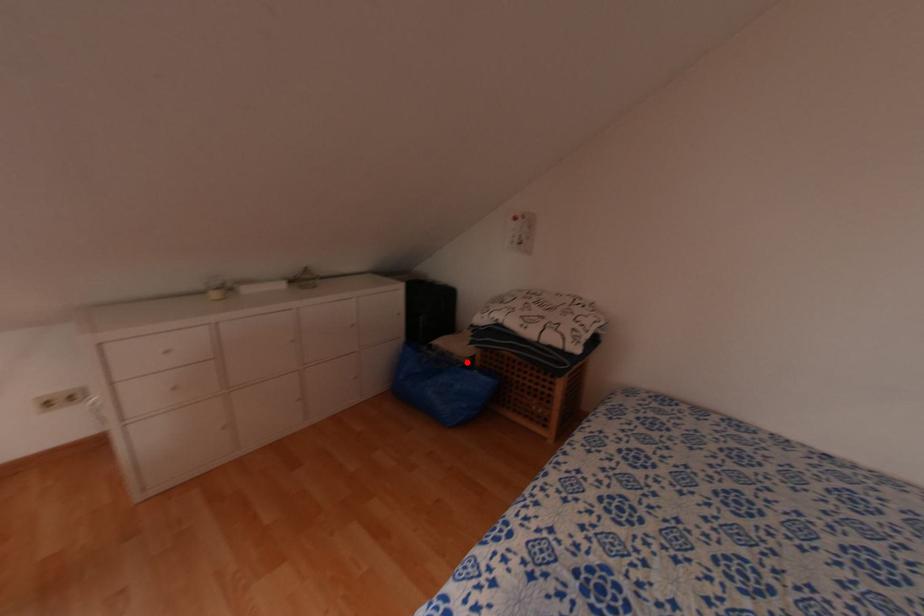
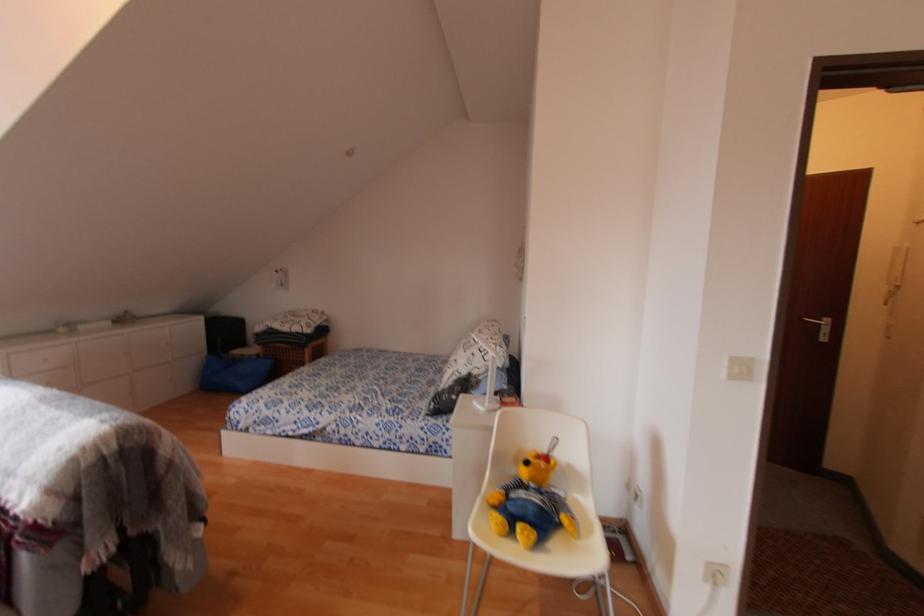
Locate, in the second image, the point that corresponds to the highlighted location in the first image.

(253, 358)